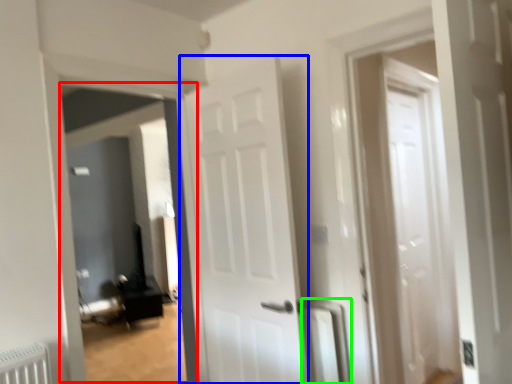
Question: Which object is the closest to the corridor (highlighted by a red box)? Choose among these: door (highlighted by a blue box) or radiator (highlighted by a green box).

Choices:
 (A) door
 (B) radiator

Answer: (A)